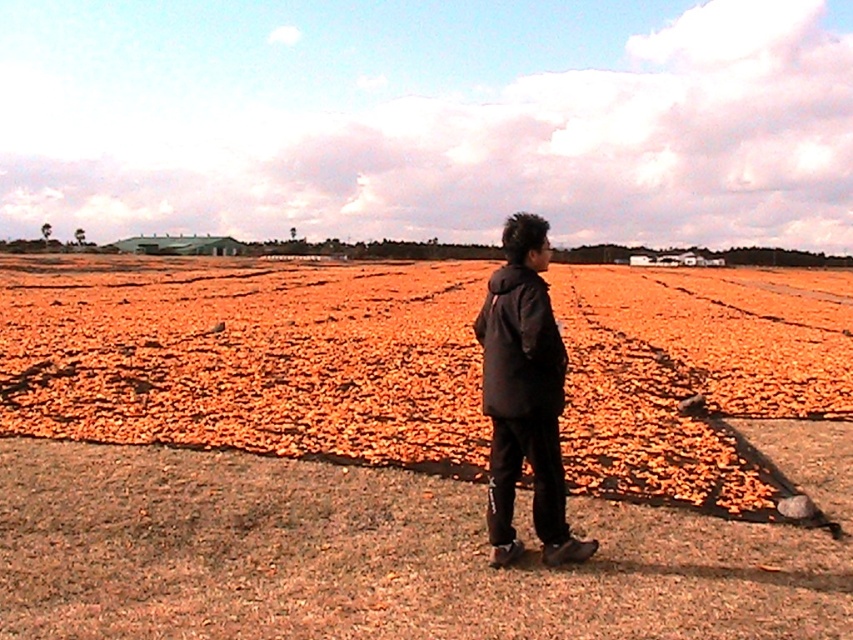
Question: Which point is closer to the camera taking this photo?

Choices:
 (A) (787, 557)
 (B) (537, 298)

Answer: (B)

Question: Which object appears closest to the camera in this image?

Choices:
 (A) brown dirt field at center
 (B) black matte jacket at center

Answer: (A)

Question: Is brown dirt field at center to the left of black matte jacket at center from the viewer's perspective?

Choices:
 (A) no
 (B) yes

Answer: (B)

Question: Is brown dirt field at center to the left of black matte jacket at center from the viewer's perspective?

Choices:
 (A) yes
 (B) no

Answer: (A)

Question: Considering the relative positions of brown dirt field at center and black matte jacket at center in the image provided, where is brown dirt field at center located with respect to black matte jacket at center?

Choices:
 (A) above
 (B) below

Answer: (A)